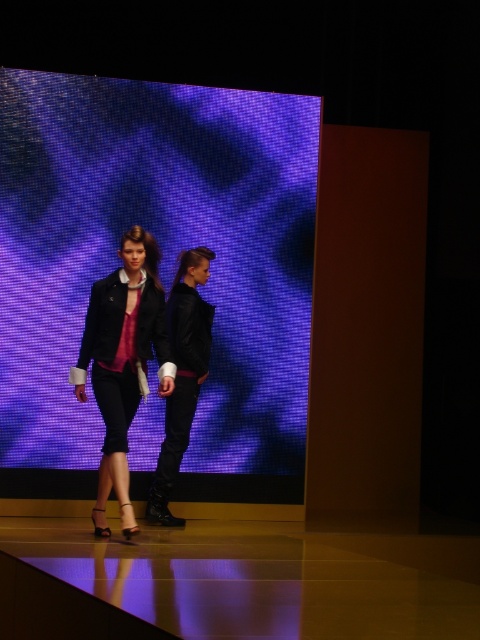
You are a photographer at the runway show. You need to capture a closeup shot of the matte black jacket at center while ensuring the shiny brown platform at lower center is still visible in the frame. Given their sizes, is it possible to include both in the same photo without cropping either object entirely?

The shiny brown platform at lower center has a larger size compared to matte black jacket at center. Since the platform is bigger, it can be positioned in the frame in a way that allows the smaller jacket to be visible alongside it without either being fully cropped out.